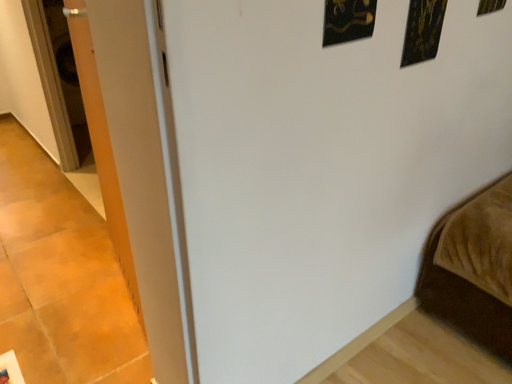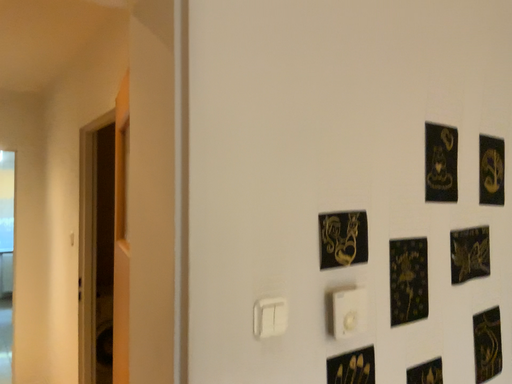
Question: How did the camera likely rotate when shooting the video?

Choices:
 (A) rotated upward
 (B) rotated downward

Answer: (A)